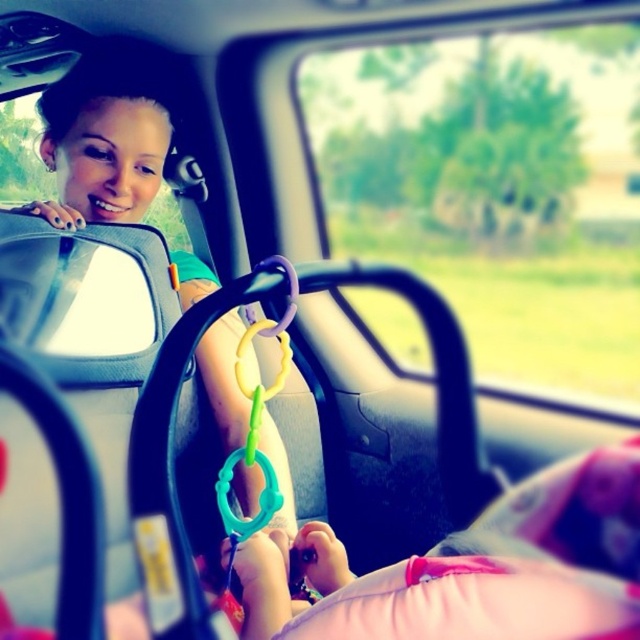
Question: Does transparent glass car window at center appear under matte black hair at upper left?

Choices:
 (A) no
 (B) yes

Answer: (A)

Question: Which point is closer to the camera?

Choices:
 (A) (502, 74)
 (B) (268, 417)

Answer: (B)

Question: Is transparent glass car window at center in front of matte black hair at upper left?

Choices:
 (A) no
 (B) yes

Answer: (A)

Question: Can you confirm if transparent glass car window at center is smaller than matte black hair at upper left?

Choices:
 (A) yes
 (B) no

Answer: (A)